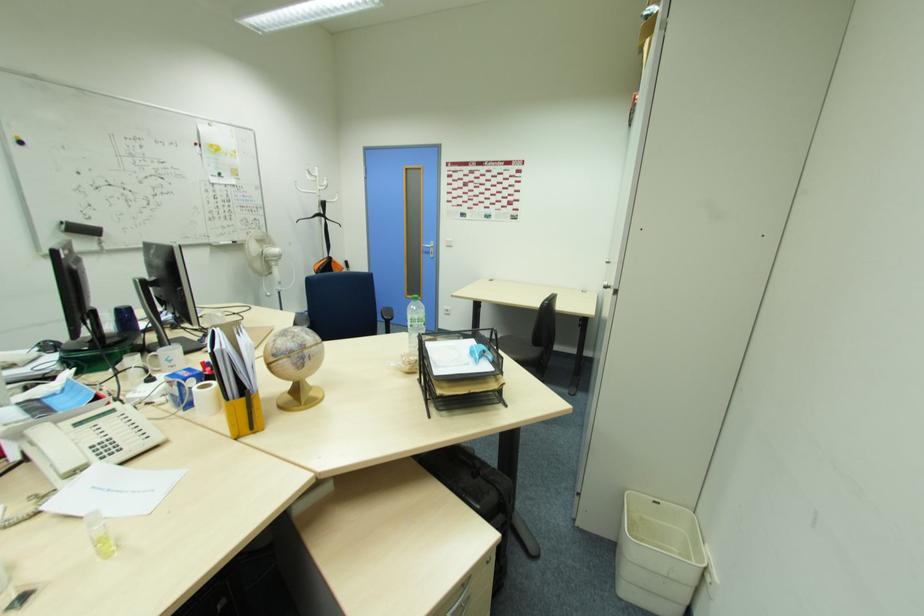
Locate an element on the screen. yellow pen holder is located at coordinates (236, 379).